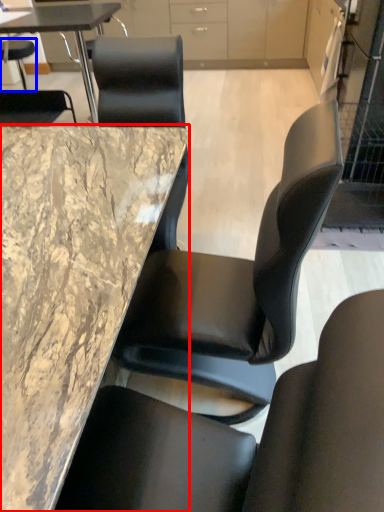
Question: Which object appears closest to the camera in this image, table (highlighted by a red box) or chair (highlighted by a blue box)?

Choices:
 (A) table
 (B) chair

Answer: (A)